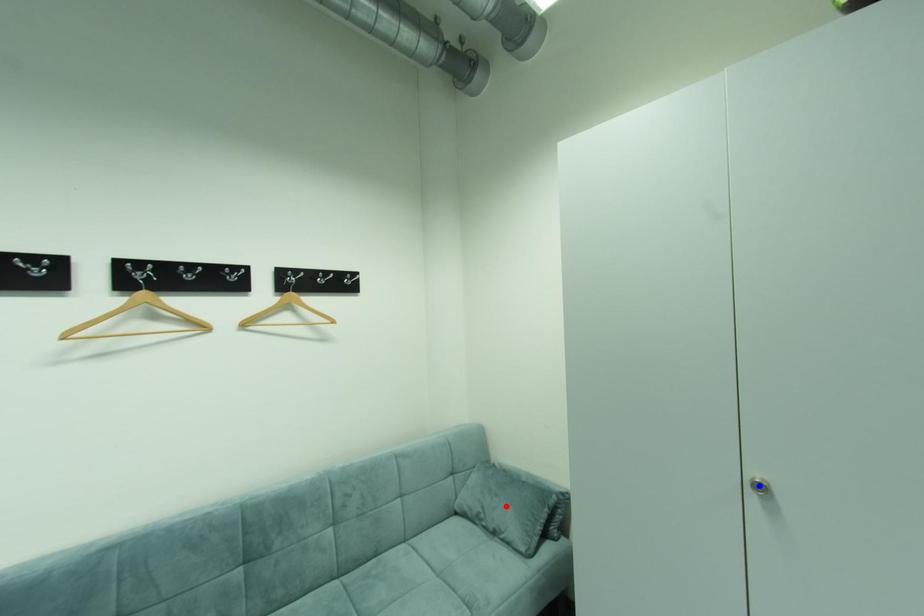
Question: Which of the two points in the image is closer to the camera?

Choices:
 (A) Blue point is closer.
 (B) Red point is closer.

Answer: (A)